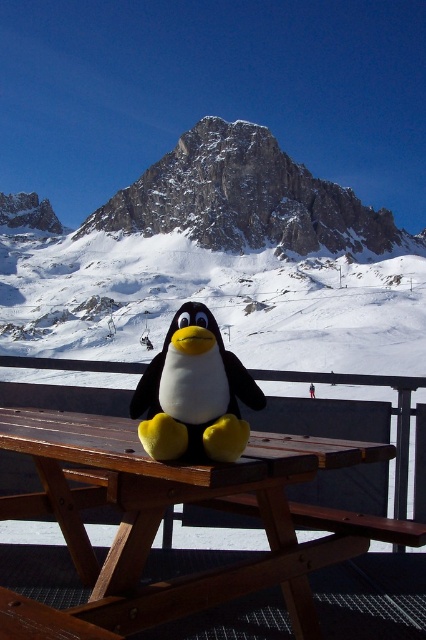
You are planning to set up a picnic and need to know which object takes up more area in the scene. Based on the image, which one is larger between the wooden picnic table at center and the snowy granite mountain at center?

The snowy granite mountain at center occupies more space than the wooden picnic table at center according to the description.

Looking at this image, you are standing at the picnic table and want to place the yellow plush penguin at center so it faces the snowy granite mountain at center. Which direction should you turn the penguin?

The snowy granite mountain at center is to the right of the yellow plush penguin at center, so you should turn the penguin to face to the right to look at the snowy granite mountain at center.